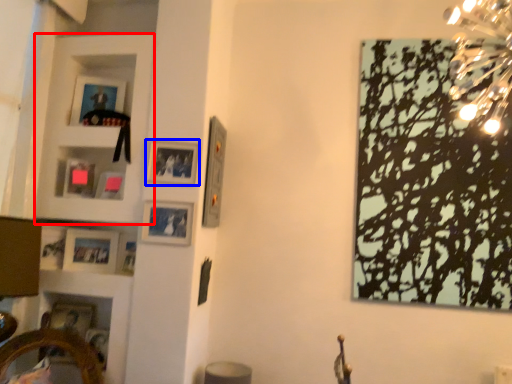
Question: Which point is further to the camera, cabinet (highlighted by a red box) or picture frame (highlighted by a blue box)?

Choices:
 (A) cabinet
 (B) picture frame

Answer: (A)